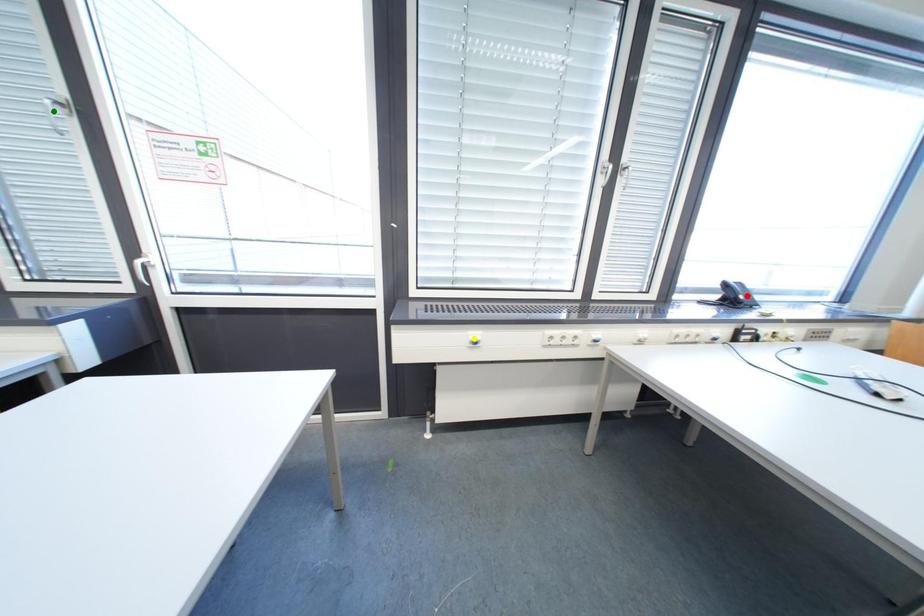
Order these from farthest to nearest:
green point | red point | yellow point

red point < yellow point < green point